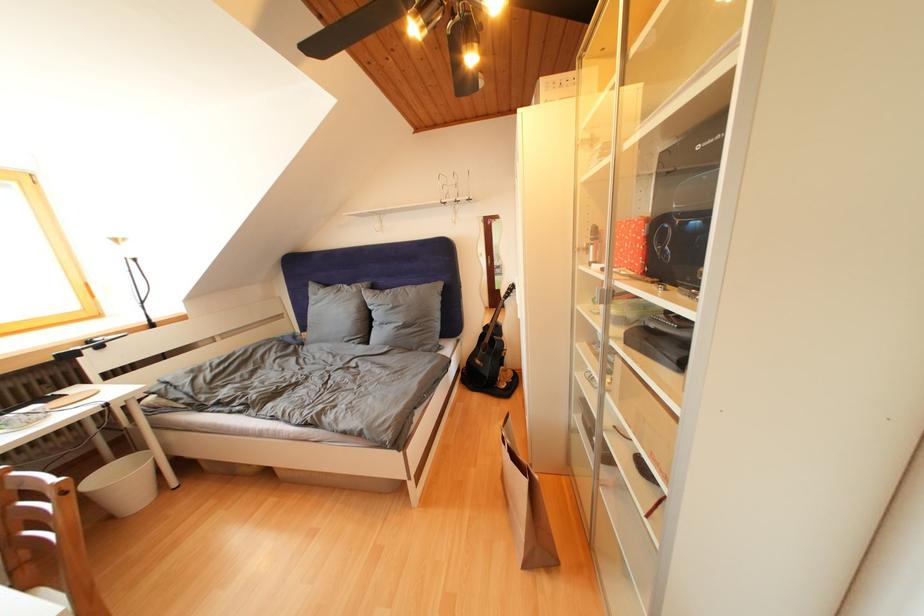
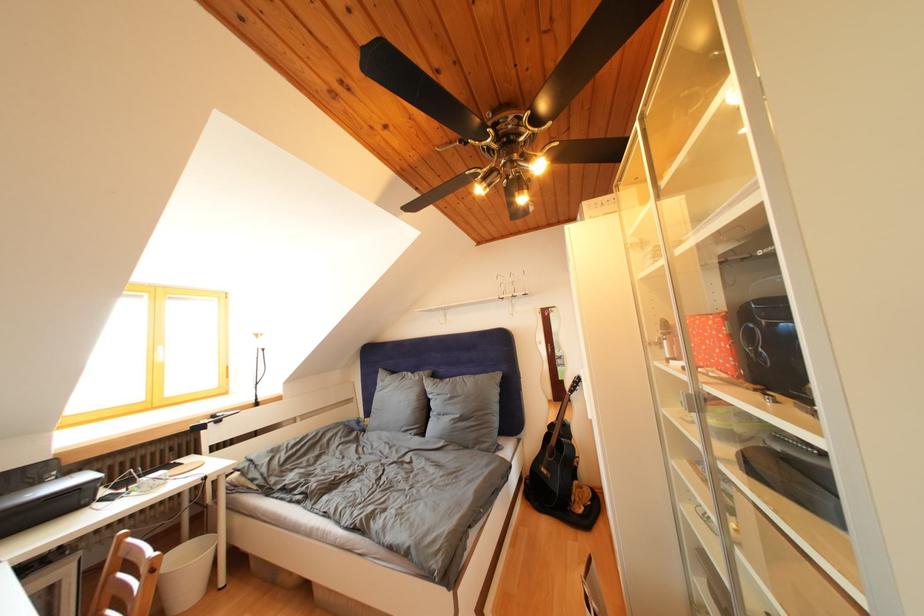
In the second image, find the point that corresponds to the point at 490,89 in the first image.

(540, 214)